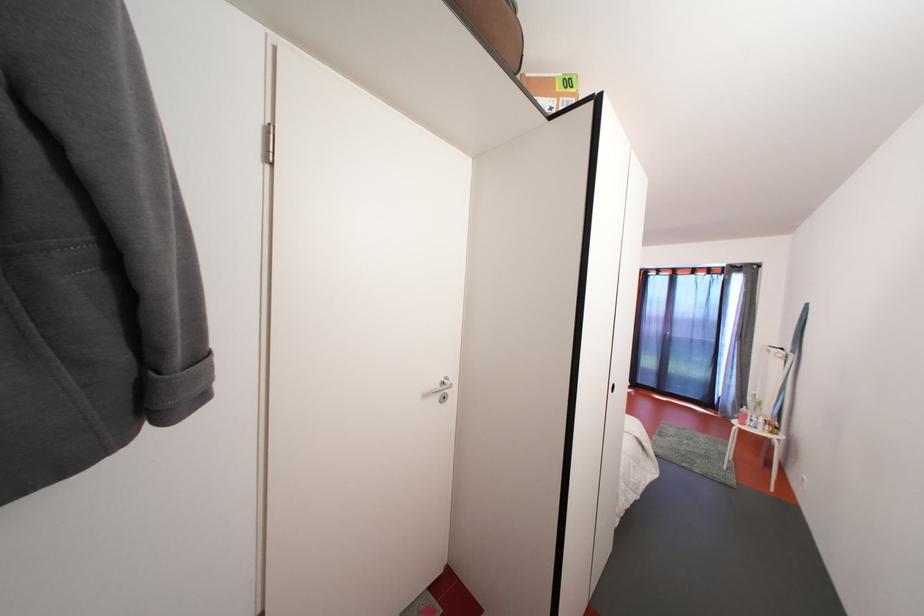
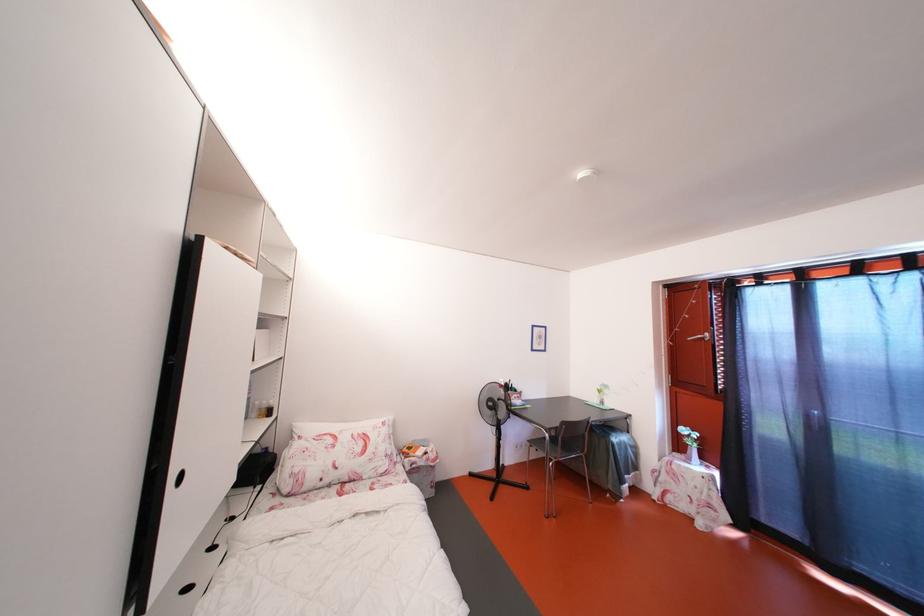
What movement of the cameraman would produce the second image?

The cameraman moved toward right, forward.